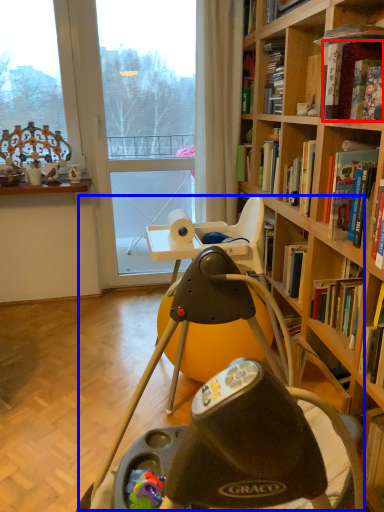
Question: Which object is closer to the camera taking this photo, book (highlighted by a red box) or swivel chair (highlighted by a blue box)?

Choices:
 (A) book
 (B) swivel chair

Answer: (B)